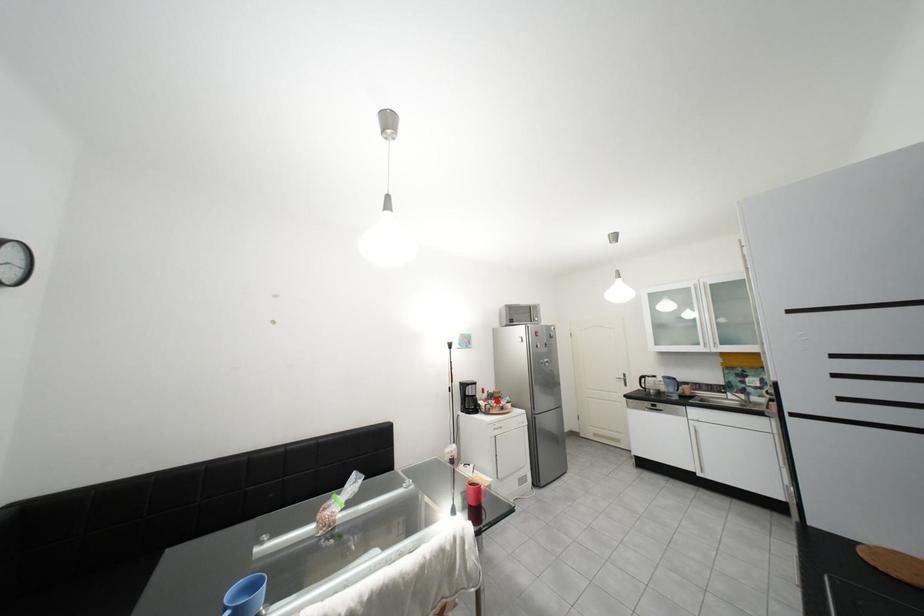
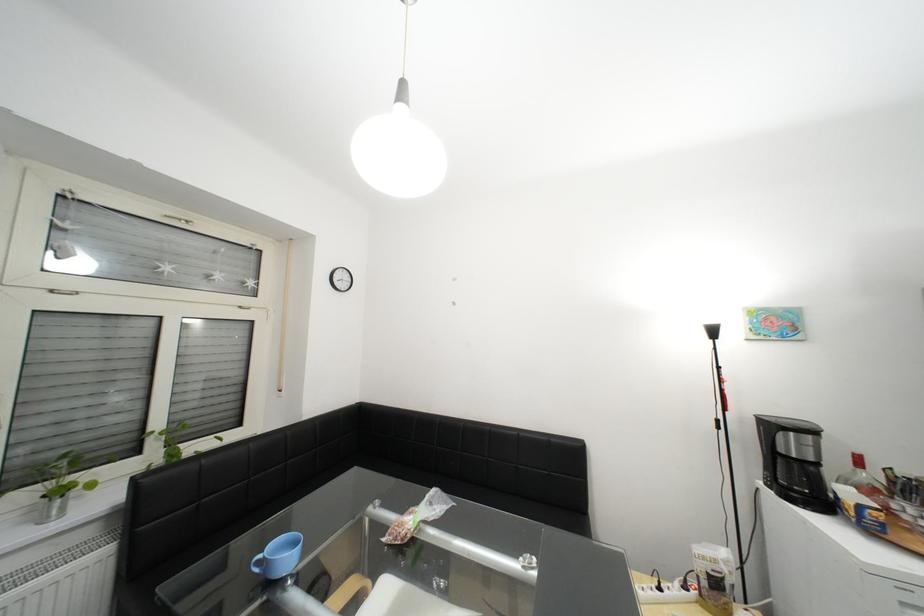
Question: I am providing you with two images of the same scene from different viewpoints. A red point is marked on the first image. Can you still see the location of the red point in image 2?

Choices:
 (A) Yes
 (B) No

Answer: (A)